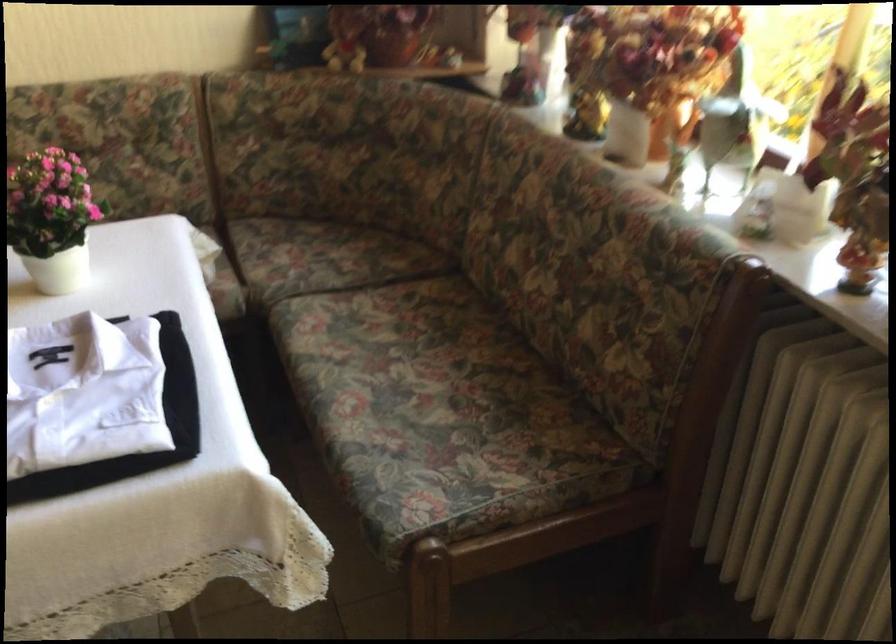
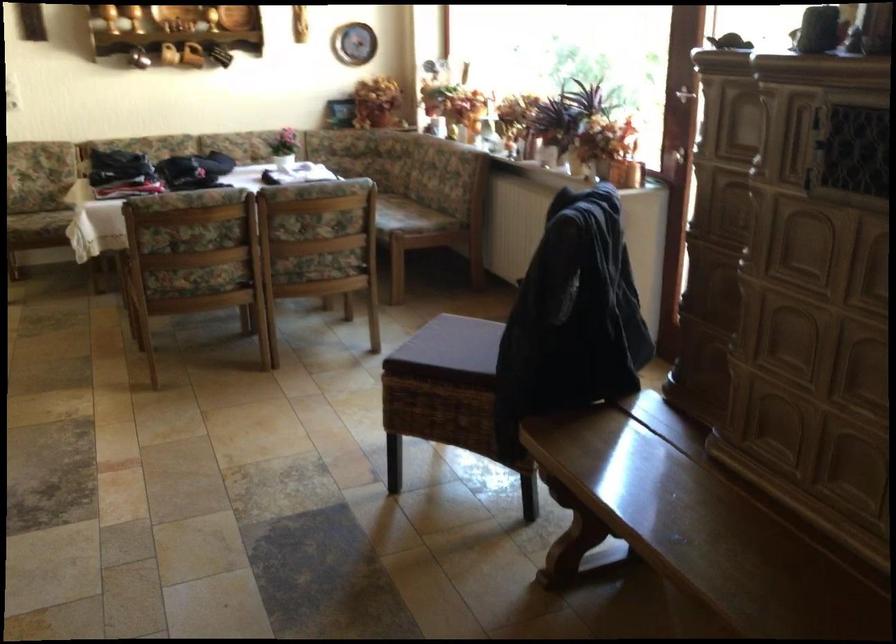
Question: Which direction would the cameraman need to move to produce the second image? Reply with the corresponding letter.

Choices:
 (A) Left
 (B) Right
 (C) Forward
 (D) Backward

Answer: (D)